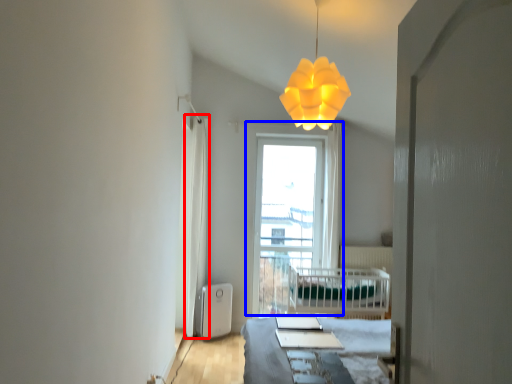
Question: Which of the following is the farthest to the observer, curtain (highlighted by a red box) or window (highlighted by a blue box)?

Choices:
 (A) curtain
 (B) window

Answer: (B)